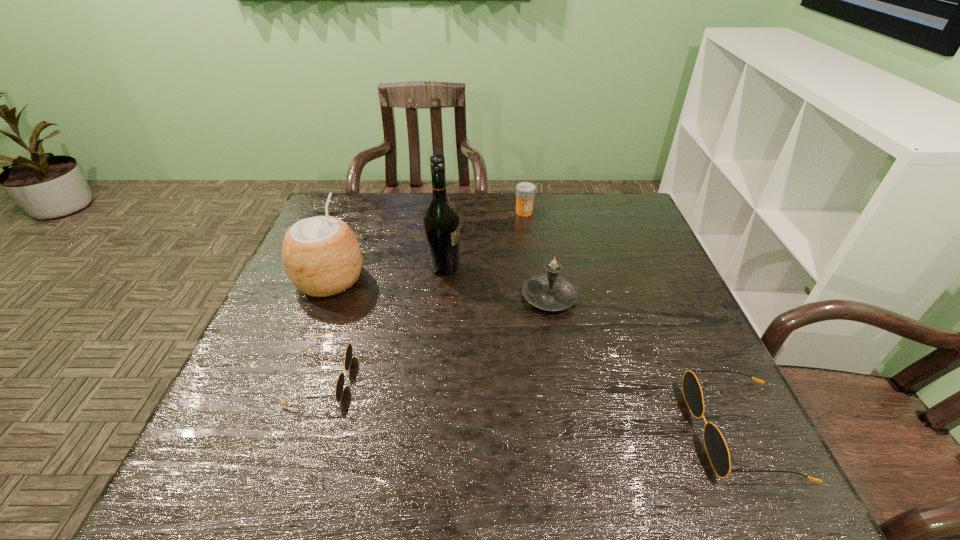
Find the location of a particular element. This screenshot has height=540, width=960. vacant space positioned on the front-facing side of the shorter sunglasses is located at coordinates (400, 379).

The width and height of the screenshot is (960, 540). In order to click on vacant region located 0.130m on the front-facing side of the taller sunglasses in this screenshot , I will do `click(626, 431)`.

Identify the location of vacant region located 0.120m on the front-facing side of the taller sunglasses. (632, 431).

Identify the location of vacant space located 0.200m on the front-facing side of the taller sunglasses. (590, 431).

The height and width of the screenshot is (540, 960). Identify the location of vacant space located 0.330m on the label side of the farthest object. (535, 286).

Locate an element on the screen. The width and height of the screenshot is (960, 540). vacant region located 0.300m on the label of the third object from left to right is located at coordinates (569, 267).

In order to click on free region located on the front of the candle in this screenshot , I will do `click(564, 386)`.

Where is `vacant space located 0.090m on the right of the coconut`? vacant space located 0.090m on the right of the coconut is located at coordinates (398, 280).

This screenshot has width=960, height=540. I want to click on object that is at the far edge, so click(x=525, y=191).

The height and width of the screenshot is (540, 960). Find the location of `sunglasses at the left edge`. sunglasses at the left edge is located at coordinates (340, 382).